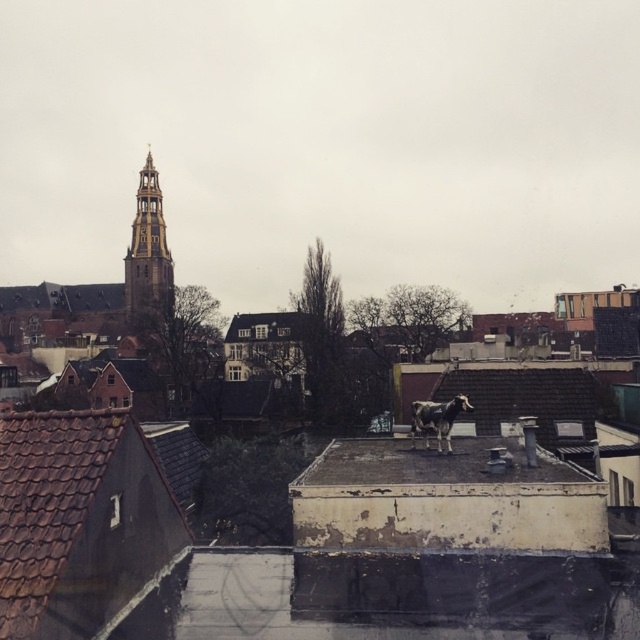
Is rusty metal roof at center to the left of golden wood tower at upper left from the viewer's perspective?

In fact, rusty metal roof at center is to the right of golden wood tower at upper left.

Locate an element on the screen. The image size is (640, 640). rusty metal roof at center is located at coordinates (429, 464).

At what (x,y) coordinates should I click in order to perform the action: click on rusty metal roof at center. Please return your answer as a coordinate pair (x, y). The image size is (640, 640). Looking at the image, I should click on (429, 464).

Does point (125, 296) come closer to viewer compared to point (420, 424)?

That is False.

Which is in front, point (157, 212) or point (422, 419)?

Point (422, 419)

The image size is (640, 640). What do you see at coordinates (147, 257) in the screenshot? I see `golden wood tower at upper left` at bounding box center [147, 257].

Image resolution: width=640 pixels, height=640 pixels. In order to click on golden wood tower at upper left in this screenshot , I will do `click(147, 257)`.

Between rusty metal roof at center and white glossy cow at center, which one appears on the left side from the viewer's perspective?

rusty metal roof at center is more to the left.

Between point (481, 461) and point (416, 413), which one is positioned in front?

Point (481, 461)

Locate an element on the screen. This screenshot has width=640, height=640. rusty metal roof at center is located at coordinates (429, 464).